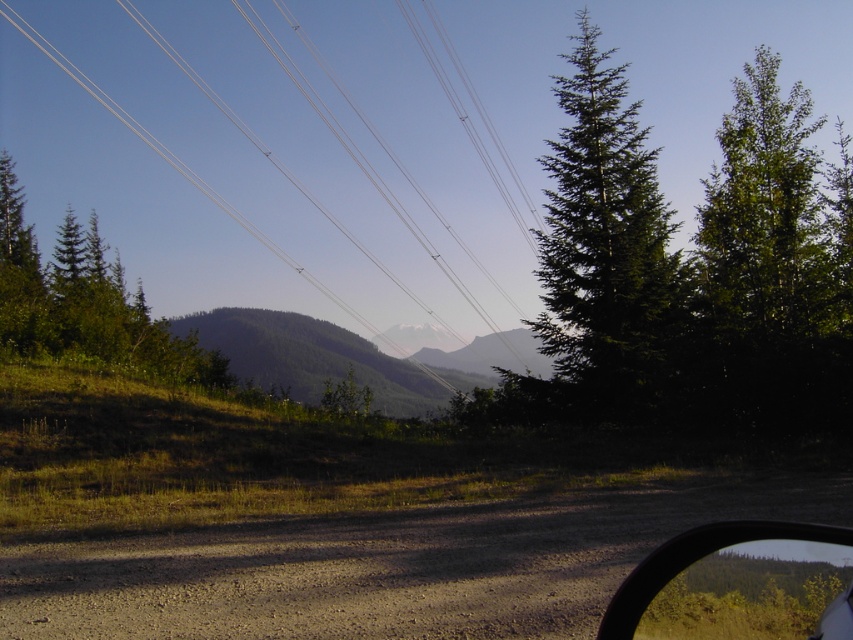
Is point (213, 49) positioned in front of point (277, 369)?

No, (213, 49) is behind (277, 369).

Does white wire at upper center have a smaller size compared to green grassy hill at center?

Actually, white wire at upper center might be larger than green grassy hill at center.

Is point (538, 58) closer to camera compared to point (462, 362)?

No, it is not.

Where is `white wire at upper center`? This screenshot has width=853, height=640. white wire at upper center is located at coordinates [346, 134].

Does point (373, 228) come closer to viewer compared to point (86, 230)?

No, it is behind (86, 230).

Between white wire at upper center and green matte tree at upper left, which one is positioned higher?

white wire at upper center is higher up.

Who is more distant from viewer, (293, 237) or (7, 260)?

The point (293, 237) is more distant.

Where is `white wire at upper center`? white wire at upper center is located at coordinates (346, 134).

Between dirt/gravel road at lower center and transparent glass car window at lower right, which one is positioned lower?

dirt/gravel road at lower center is lower down.

Can you confirm if dirt/gravel road at lower center is thinner than transparent glass car window at lower right?

In fact, dirt/gravel road at lower center might be wider than transparent glass car window at lower right.

Describe the element at coordinates (386, 566) in the screenshot. I see `dirt/gravel road at lower center` at that location.

Where is `dirt/gravel road at lower center`? dirt/gravel road at lower center is located at coordinates [386, 566].